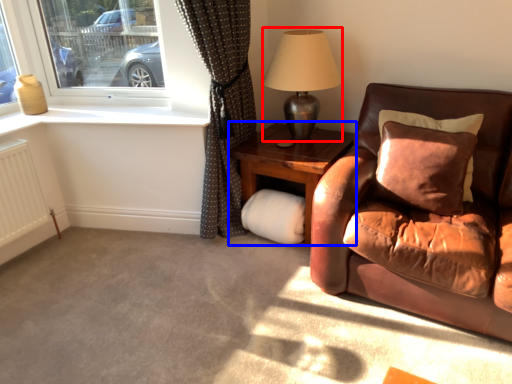
Question: Which of the following is the closest to the observer, table lamp (highlighted by a red box) or table (highlighted by a blue box)?

Choices:
 (A) table lamp
 (B) table

Answer: (A)